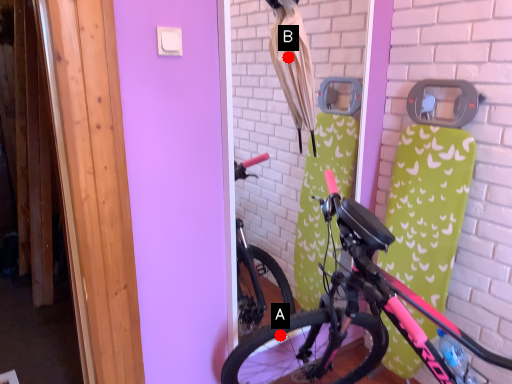
Question: Two points are circled on the image, labeled by A and B beside each circle. Which point is closer to the camera?

Choices:
 (A) A is closer
 (B) B is closer

Answer: (A)